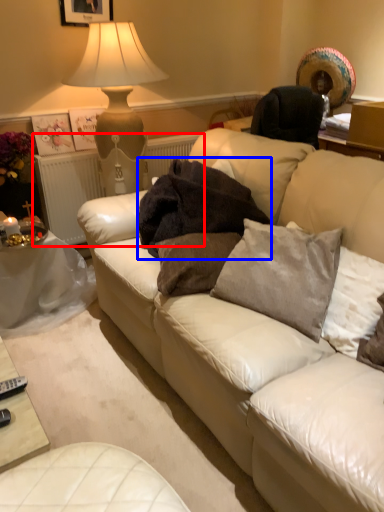
Question: Which of the following is the closest to the observer, radiator (highlighted by a red box) or blanket (highlighted by a blue box)?

Choices:
 (A) radiator
 (B) blanket

Answer: (B)